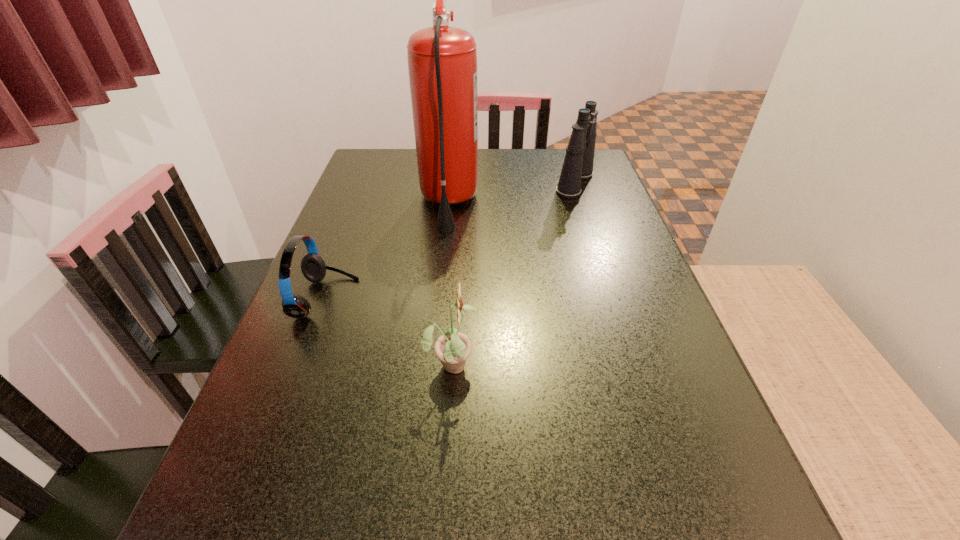
At what (x,y) coordinates should I click in order to perform the action: click on the tallest object. Please return your answer as a coordinate pair (x, y). This screenshot has width=960, height=540. Looking at the image, I should click on (442, 61).

At what (x,y) coordinates should I click in order to perform the action: click on binoculars. Please return your answer as a coordinate pair (x, y). Looking at the image, I should click on (578, 163).

Identify the location of the second tallest object. The height and width of the screenshot is (540, 960). (578, 163).

You are a GUI agent. You are given a task and a screenshot of the screen. Output one action in this format:
    pyautogui.click(x=<x>, y=<y>)
    Task: Click on the third tallest object
    
    Given the screenshot: What is the action you would take?
    pyautogui.click(x=452, y=348)

Locate an element on the screen. The image size is (960, 540). the nearest object is located at coordinates (452, 348).

Find the location of `the leftmost object`. the leftmost object is located at coordinates (313, 267).

In order to click on headset in this screenshot , I will do `click(313, 267)`.

The width and height of the screenshot is (960, 540). I want to click on vacant space situated 0.280m on the instruction side of the fire extinguisher, so click(578, 202).

Find the location of a particular element. free region located on the left of the binoculars is located at coordinates (473, 183).

This screenshot has height=540, width=960. Identify the location of free space located 0.300m on the front-facing side of the second shortest object. (640, 363).